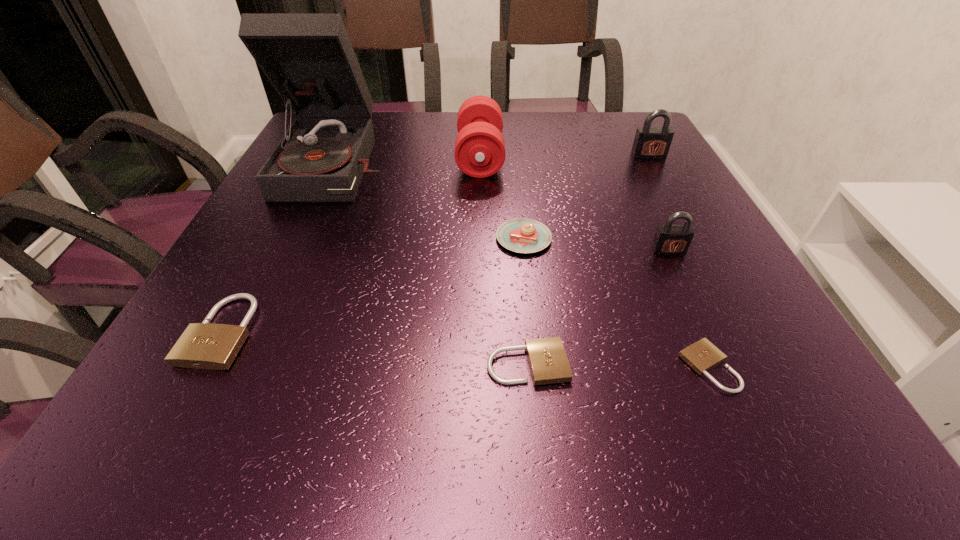
Identify which beige padlock is located as the nearest to the dumbbell. Please provide its 2D coordinates. Your answer should be formatted as a tuple, i.e. [(x, y)], where the tuple contains the x and y coordinates of a point satisfying the conditions above.

[(548, 362)]

This screenshot has width=960, height=540. Find the location of `free location that satisfies the following two spatial constraints: 1. on the front side of the second shortest padlock; 2. on the left side of the dumbbell`. free location that satisfies the following two spatial constraints: 1. on the front side of the second shortest padlock; 2. on the left side of the dumbbell is located at coordinates (480, 364).

Image resolution: width=960 pixels, height=540 pixels. Find the location of `vacant space that satisfies the following two spatial constraints: 1. on the front side of the second beige padlock from left to right; 2. on the left side of the third shortest object`. vacant space that satisfies the following two spatial constraints: 1. on the front side of the second beige padlock from left to right; 2. on the left side of the third shortest object is located at coordinates (204, 364).

Locate an element on the screen. The height and width of the screenshot is (540, 960). free space that satisfies the following two spatial constraints: 1. on the front side of the dumbbell; 2. on the right side of the fourth tallest padlock is located at coordinates (480, 364).

In order to click on vacant region that satisfies the following two spatial constraints: 1. on the front side of the smallest beige padlock; 2. on the left side of the third shortest object in this screenshot , I will do `click(203, 367)`.

Find the location of `free spot that satisfies the following two spatial constraints: 1. on the front side of the pastry; 2. on the left side of the dumbbell`. free spot that satisfies the following two spatial constraints: 1. on the front side of the pastry; 2. on the left side of the dumbbell is located at coordinates (480, 239).

Where is `free space that satisfies the following two spatial constraints: 1. on the front side of the dumbbell; 2. on the left side of the shortest padlock`? Image resolution: width=960 pixels, height=540 pixels. free space that satisfies the following two spatial constraints: 1. on the front side of the dumbbell; 2. on the left side of the shortest padlock is located at coordinates (480, 367).